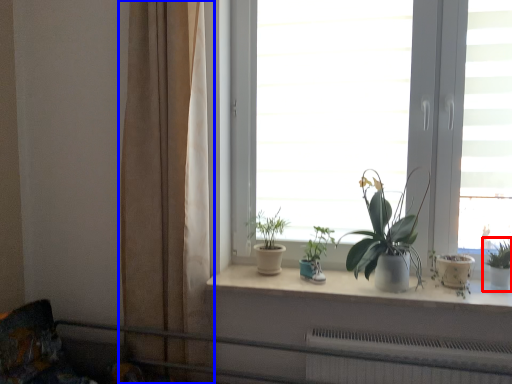
Question: Which point is further to the camera, houseplant (highlighted by a red box) or curtain (highlighted by a blue box)?

Choices:
 (A) houseplant
 (B) curtain

Answer: (A)